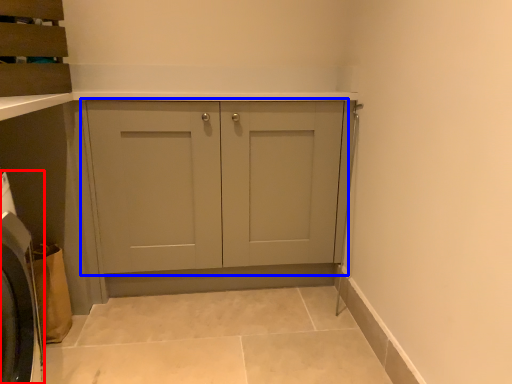
Question: Which point is further to the camera, washing machine (highlighted by a red box) or cupboard (highlighted by a blue box)?

Choices:
 (A) washing machine
 (B) cupboard

Answer: (B)